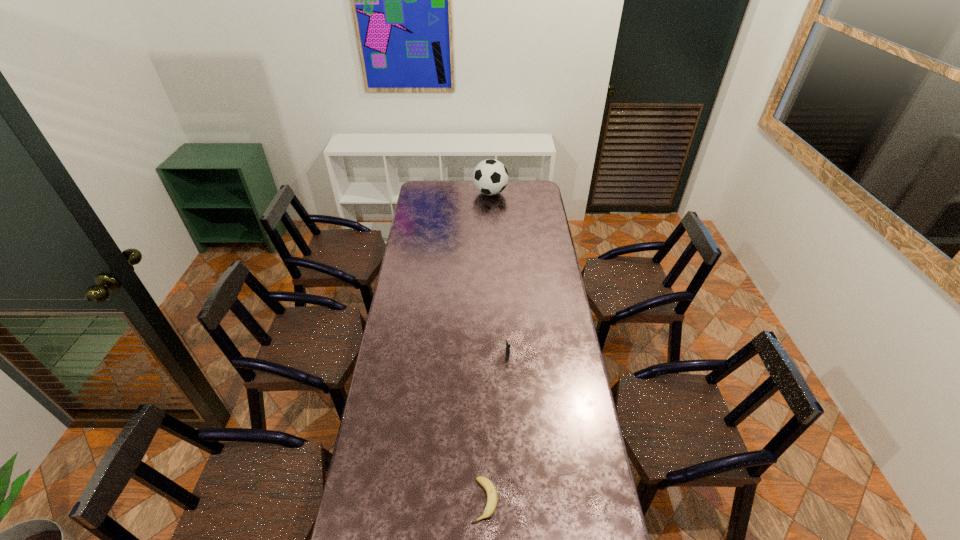
Image resolution: width=960 pixels, height=540 pixels. In the image, there is a desktop. In order to click on vacant space at the far edge in this screenshot , I will do `click(514, 194)`.

Identify the location of free spot at the left edge of the desktop. (374, 476).

Find the location of a particular element. This screenshot has width=960, height=540. vacant space at the right edge is located at coordinates (530, 229).

The height and width of the screenshot is (540, 960). I want to click on free space between the tallest object and the second shortest object, so click(x=499, y=274).

Find the location of a particular element. This screenshot has height=540, width=960. free space between the nearest object and the second tallest object is located at coordinates (496, 428).

Find the location of a particular element. Image resolution: width=960 pixels, height=540 pixels. vacant region between the second farthest object and the farthest object is located at coordinates (499, 274).

Locate an element on the screen. The width and height of the screenshot is (960, 540). free space between the tallest object and the nearest object is located at coordinates (488, 347).

Identify the location of free point between the second tallest object and the tallest object. The image size is (960, 540). (499, 274).

In order to click on vacant space that is in between the tallest object and the nearest object in this screenshot , I will do point(488,347).

At what (x,y) coordinates should I click in order to perform the action: click on free space between the shortest object and the tallest object. Please return your answer as a coordinate pair (x, y). The height and width of the screenshot is (540, 960). Looking at the image, I should click on (x=488, y=347).